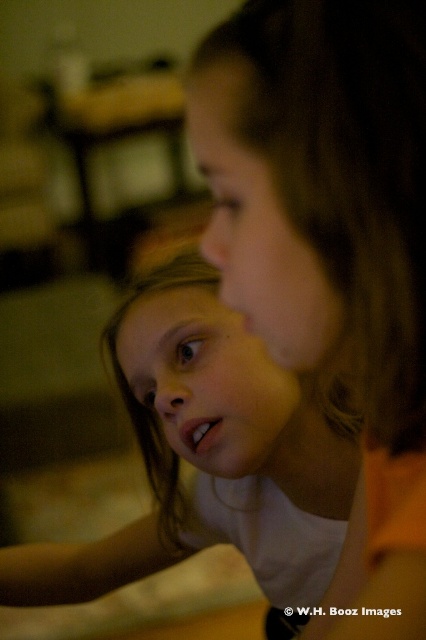
Question: Is matte orange shirt at center to the right of smooth white shirt at center from the viewer's perspective?

Choices:
 (A) no
 (B) yes

Answer: (B)

Question: Can you confirm if matte orange shirt at center is positioned above smooth white shirt at center?

Choices:
 (A) yes
 (B) no

Answer: (A)

Question: Considering the relative positions of matte orange shirt at center and smooth white shirt at center in the image provided, where is matte orange shirt at center located with respect to smooth white shirt at center?

Choices:
 (A) below
 (B) above

Answer: (B)

Question: Which object appears farthest from the camera in this image?

Choices:
 (A) smooth white shirt at center
 (B) matte orange shirt at center

Answer: (A)

Question: Which object is closer to the camera taking this photo?

Choices:
 (A) matte orange shirt at center
 (B) smooth white shirt at center

Answer: (A)